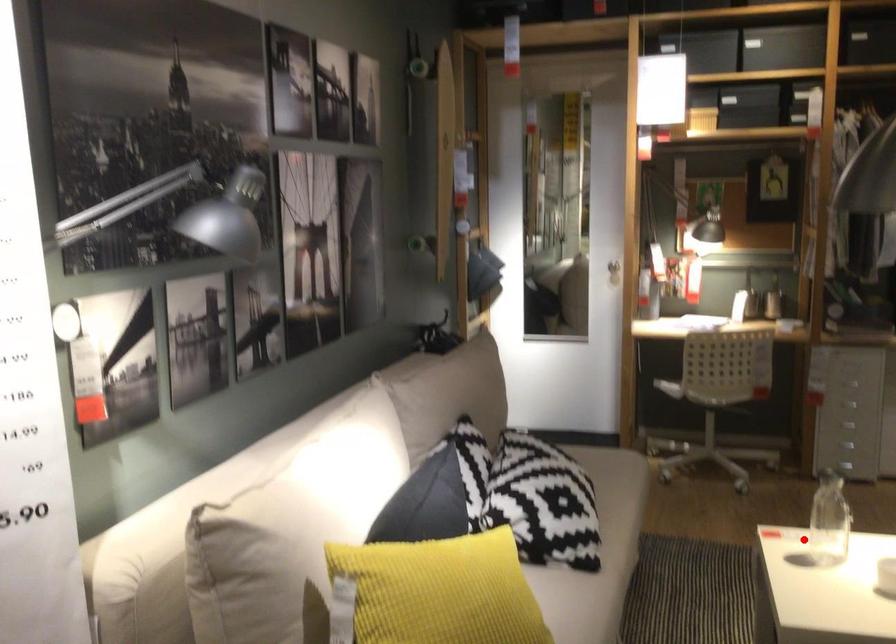
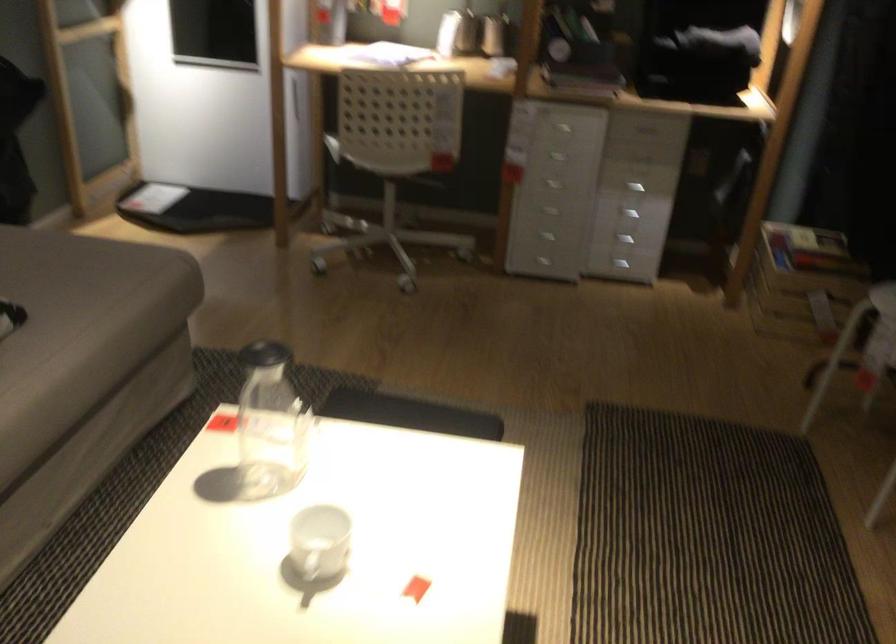
Question: I am providing you with two images of the same scene from different viewpoints. In image1, a red point is highlighted. Considering the same 3D point in image2, which of the following is correct?

Choices:
 (A) It is closer
 (B) It is farther

Answer: (A)